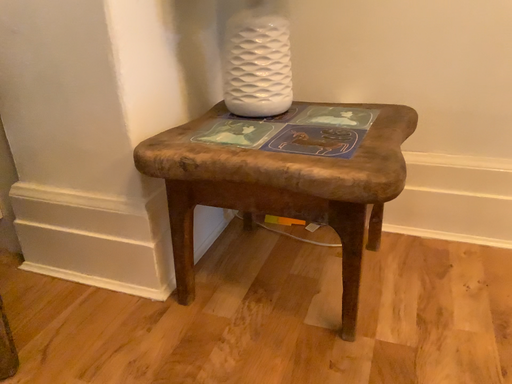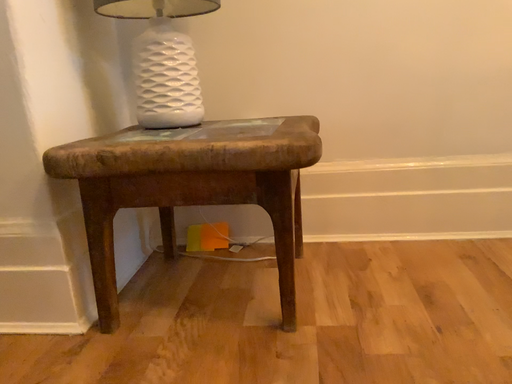
Question: How did the camera likely rotate when shooting the video?

Choices:
 (A) rotated right
 (B) rotated left

Answer: (A)